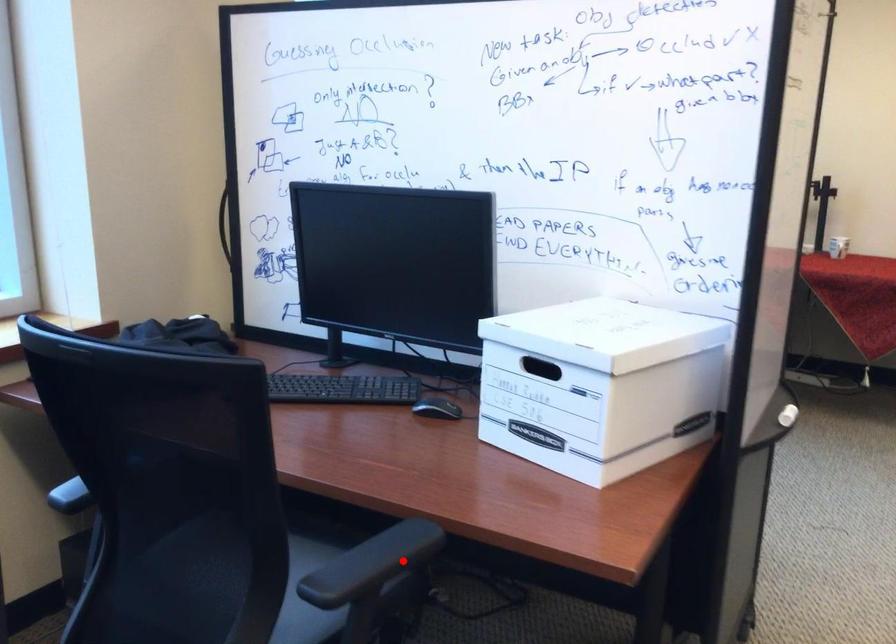
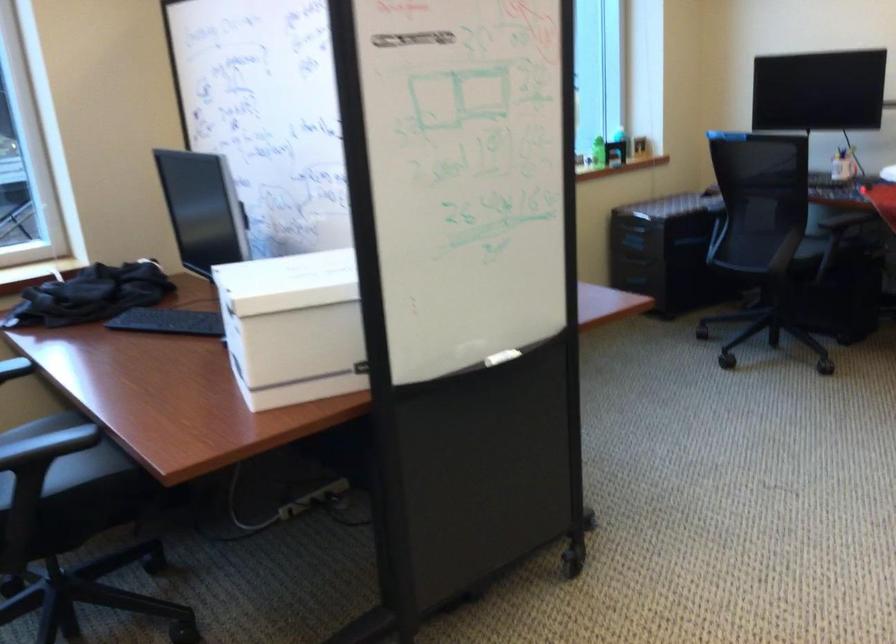
Find the pixel in the second image that matches the highlighted location in the first image.

(47, 446)